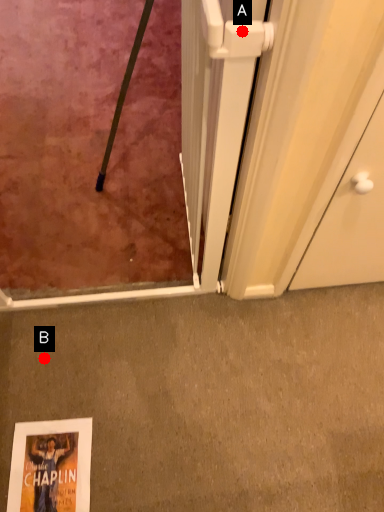
Question: Two points are circled on the image, labeled by A and B beside each circle. Among these points, which one is farthest from the camera?

Choices:
 (A) A is further
 (B) B is further

Answer: (B)